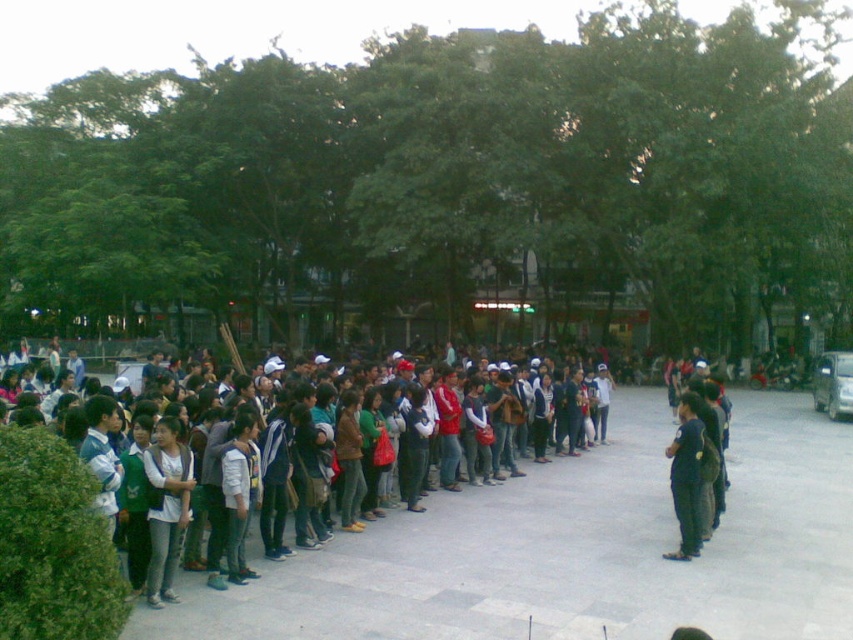
Is light gray jeans at lower left positioned at the back of dark blue jeans at center?

No, it is not.

Between light gray jeans at lower left and dark blue jeans at center, which one is positioned higher?

light gray jeans at lower left is above.

Measure the distance between light gray jeans at lower left and camera.

light gray jeans at lower left and camera are 7.16 meters apart from each other.

At what (x,y) coordinates should I click in order to perform the action: click on light gray jeans at lower left. Please return your answer as a coordinate pair (x, y). This screenshot has height=640, width=853. Looking at the image, I should click on (166, 506).

Between green leafy tree at center and light gray jeans at lower left, which one has more height?

green leafy tree at center is taller.

Between green leafy tree at center and light gray jeans at lower left, which one is positioned higher?

green leafy tree at center is above.

Which is behind, point (821, 161) or point (186, 522)?

The point (821, 161) is more distant.

Where is `green leafy tree at center`? green leafy tree at center is located at coordinates (450, 188).

Describe the element at coordinates (450, 188) in the screenshot. I see `green leafy tree at center` at that location.

Who is positioned more to the right, green leafy tree at center or dark blue jeans at center?

dark blue jeans at center

Identify the location of green leafy tree at center. The height and width of the screenshot is (640, 853). (450, 188).